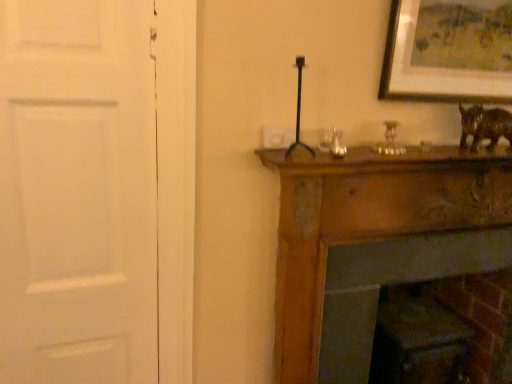
Question: Is brown glossy statue at upper right positioned beyond the bounds of white matte door at left?

Choices:
 (A) no
 (B) yes

Answer: (B)

Question: Is brown glossy statue at upper right facing away from white matte door at left?

Choices:
 (A) no
 (B) yes

Answer: (A)

Question: Considering the relative sizes of brown glossy statue at upper right and white matte door at left in the image provided, is brown glossy statue at upper right taller than white matte door at left?

Choices:
 (A) yes
 (B) no

Answer: (B)

Question: Can you confirm if brown glossy statue at upper right is thinner than white matte door at left?

Choices:
 (A) no
 (B) yes

Answer: (A)

Question: Can you confirm if brown glossy statue at upper right is positioned to the left of white matte door at left?

Choices:
 (A) no
 (B) yes

Answer: (A)

Question: Is brick fireplace at lower right bigger or smaller than brown glossy statue at upper right?

Choices:
 (A) small
 (B) big

Answer: (B)

Question: Is brick fireplace at lower right wider or thinner than brown glossy statue at upper right?

Choices:
 (A) thin
 (B) wide

Answer: (B)

Question: From a real-world perspective, is brick fireplace at lower right above or below brown glossy statue at upper right?

Choices:
 (A) above
 (B) below

Answer: (B)

Question: Is brick fireplace at lower right in front of or behind brown glossy statue at upper right in the image?

Choices:
 (A) front
 (B) behind

Answer: (B)

Question: Is point (287, 140) closer or farther from the camera than point (418, 56)?

Choices:
 (A) farther
 (B) closer

Answer: (B)

Question: In terms of height, does white plastic light switch at upper center look taller or shorter compared to wooden framed artwork at upper right?

Choices:
 (A) short
 (B) tall

Answer: (A)

Question: Is white plastic light switch at upper center in front of or behind wooden framed artwork at upper right in the image?

Choices:
 (A) behind
 (B) front

Answer: (A)

Question: From a real-world perspective, relative to wooden framed artwork at upper right, is white plastic light switch at upper center vertically above or below?

Choices:
 (A) above
 (B) below

Answer: (B)

Question: In terms of height, does white plastic light switch at upper center look taller or shorter compared to metallic gold candle holder at upper center?

Choices:
 (A) short
 (B) tall

Answer: (A)

Question: Looking at the image, does white plastic light switch at upper center seem bigger or smaller compared to metallic gold candle holder at upper center?

Choices:
 (A) big
 (B) small

Answer: (B)